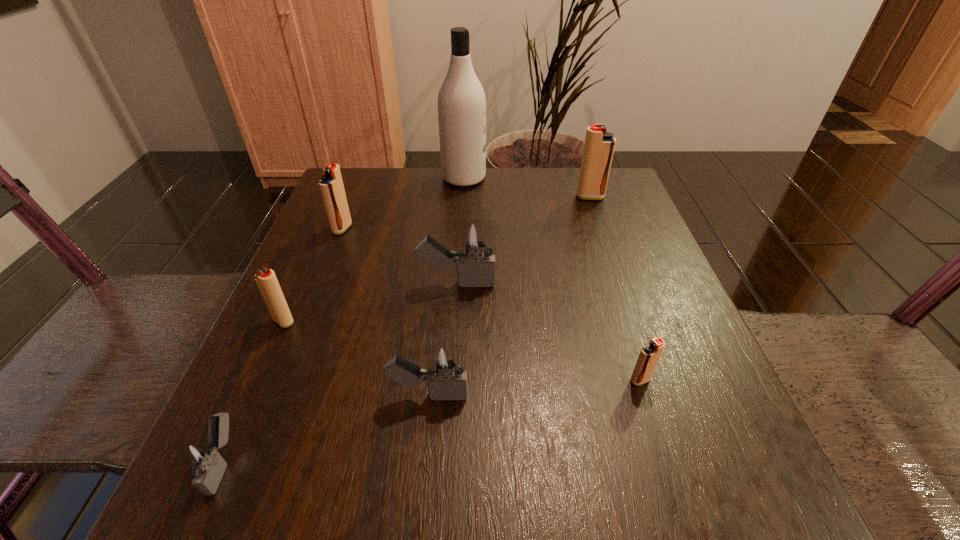
I want to click on free space that satisfies the following two spatial constraints: 1. on the front side of the nearest red igniter; 2. on the left side of the sixth nearest igniter, so click(x=282, y=380).

What are the coordinates of `vacant region that satisfies the following two spatial constraints: 1. on the front side of the third biggest red igniter; 2. on the right side of the nearest red igniter` in the screenshot? It's located at (257, 380).

Locate an element on the screen. The height and width of the screenshot is (540, 960). free space that satisfies the following two spatial constraints: 1. on the front-facing side of the smallest red igniter; 2. on the right side of the tallest object is located at coordinates (453, 380).

Find the location of a particular element. free space that satisfies the following two spatial constraints: 1. on the front-facing side of the farthest object; 2. on the front side of the fifth nearest object is located at coordinates (458, 284).